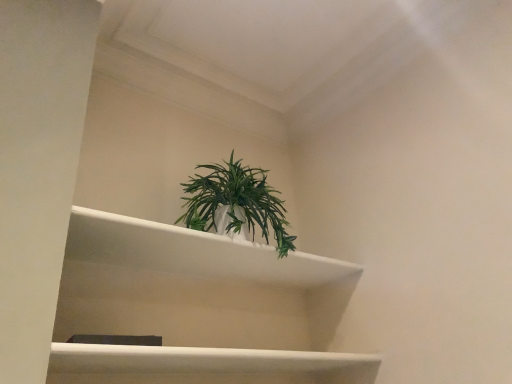
Question: Is the position of green matte plant at center less distant than that of white glossy shelf at center?

Choices:
 (A) no
 (B) yes

Answer: (A)

Question: Can you confirm if green matte plant at center is shorter than white glossy shelf at center?

Choices:
 (A) yes
 (B) no

Answer: (A)

Question: Is green matte plant at center placed right next to white glossy shelf at center?

Choices:
 (A) no
 (B) yes

Answer: (A)

Question: Considering the relative sizes of green matte plant at center and white glossy shelf at center in the image provided, is green matte plant at center smaller than white glossy shelf at center?

Choices:
 (A) no
 (B) yes

Answer: (B)

Question: Is green matte plant at center not near white glossy shelf at center?

Choices:
 (A) yes
 (B) no

Answer: (B)

Question: Can we say green matte plant at center lies outside white glossy shelf at center?

Choices:
 (A) yes
 (B) no

Answer: (A)

Question: From the image's perspective, would you say white glossy shelf at center is shown under green matte plant at center?

Choices:
 (A) yes
 (B) no

Answer: (A)

Question: Is green matte plant at center a part of white glossy shelf at center?

Choices:
 (A) no
 (B) yes

Answer: (A)

Question: Is white glossy shelf at center next to green matte plant at center?

Choices:
 (A) yes
 (B) no

Answer: (B)

Question: Is white glossy shelf at center in front of green matte plant at center?

Choices:
 (A) yes
 (B) no

Answer: (A)

Question: Can you confirm if white glossy shelf at center is bigger than green matte plant at center?

Choices:
 (A) no
 (B) yes

Answer: (B)

Question: Is white glossy shelf at center facing towards green matte plant at center?

Choices:
 (A) yes
 (B) no

Answer: (B)

Question: Is white glossy shelf at center wider or thinner than green matte plant at center?

Choices:
 (A) wide
 (B) thin

Answer: (A)